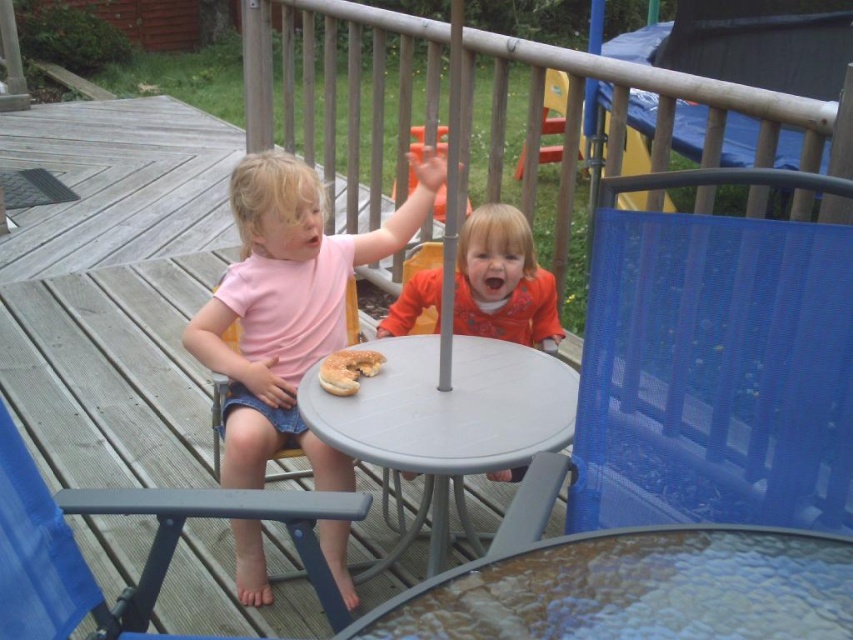
You are a photographer trying to capture both the translucent glass table at center and the golden glazed donut at center in a single shot. Based on their positions, which object should you focus on first to ensure both are in focus?

The translucent glass table at center is in front of the golden glazed donut at center, so you should focus on the translucent glass table at center first to ensure both are in focus.

You are standing at point (820, 544) and want to take a photo of the two children at the table. The camera you have can focus on objects within 1.2 meters. Will the camera be able to focus on the children?

The distance between point (820, 544) and the camera is 1.07 meters, which is within the camera focus range of 1.2 meters. Therefore, the camera will be able to focus on the children.

You are a parent trying to locate the golden glazed donut at center for your child. Based on the scene, where would you find it relative to the translucent glass table at center?

The golden glazed donut at center is above the translucent glass table at center because the translucent glass table at center is located below golden glazed donut at center.